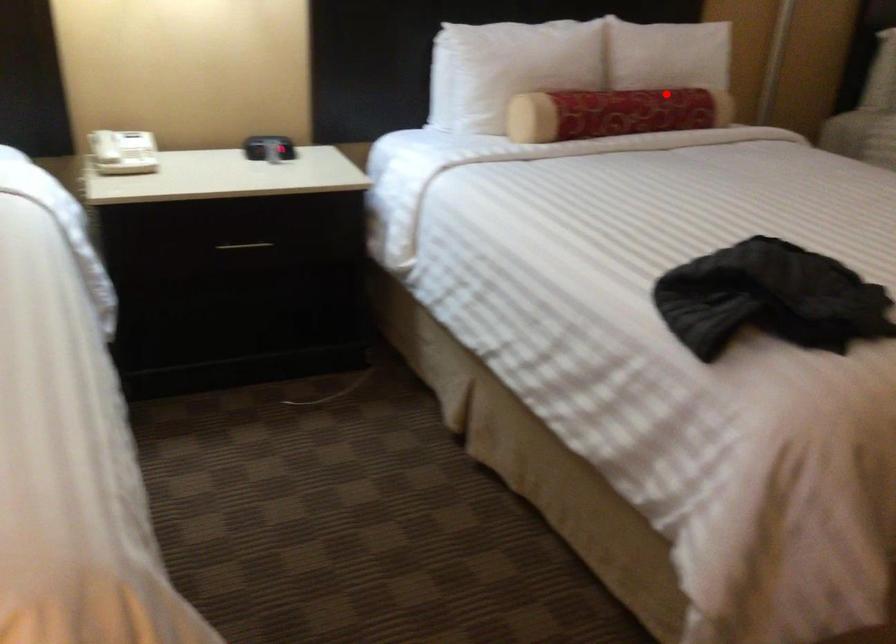
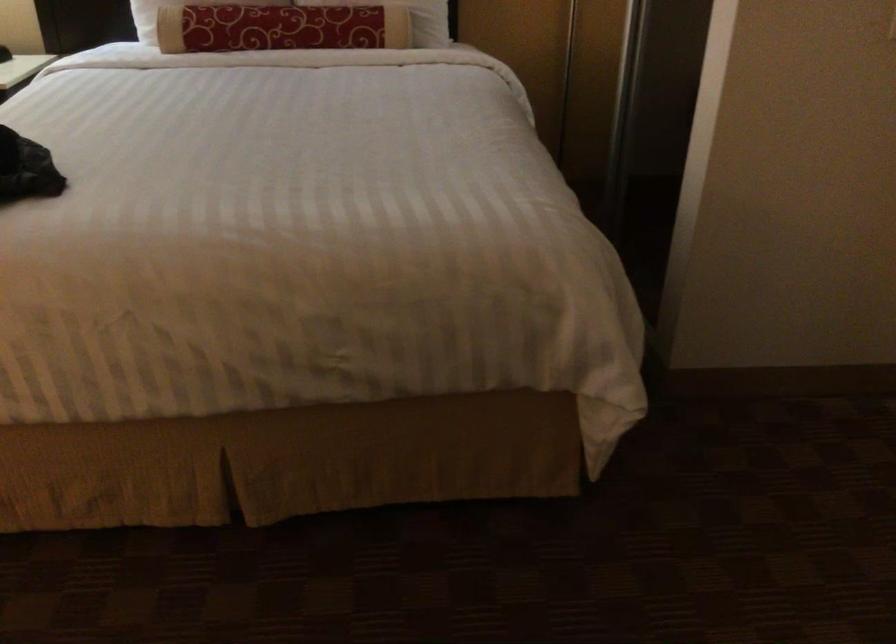
Question: I am providing you with two images of the same scene from different viewpoints. A red point is marked on the first image. At the location where the point appears in image 1, is it still visible in image 2?

Choices:
 (A) Yes
 (B) No

Answer: (A)